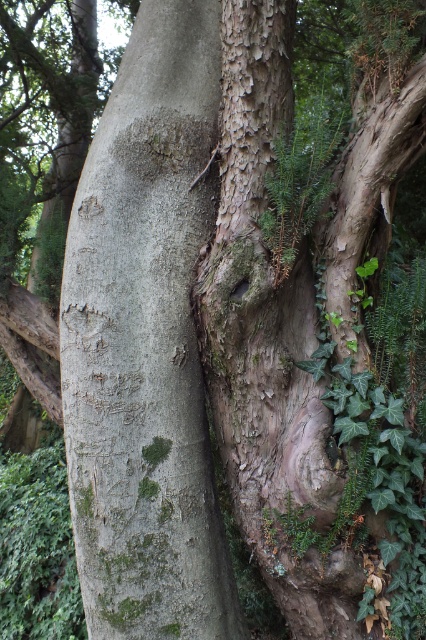
You are an ecologist examining a tree trunk. You notice two distinct areas of bark on the trunk. The first is the green mossy bark at center, and the second is the smooth bark tree trunk at center. Based on their positions, which of these two areas is located to the right side of the other?

The smooth bark tree trunk at center is to the right of the green mossy bark at center because the green mossy bark at center is positioned to the left of it.

You are an arborist examining the tree trunk. You notice two areas of interest on the tree trunk. The first is the green mossy bark at center, and the second is the smooth bark tree trunk at center. Which of these two areas is taller?

The green mossy bark at center is much taller than the smooth bark tree trunk at center according to the description.